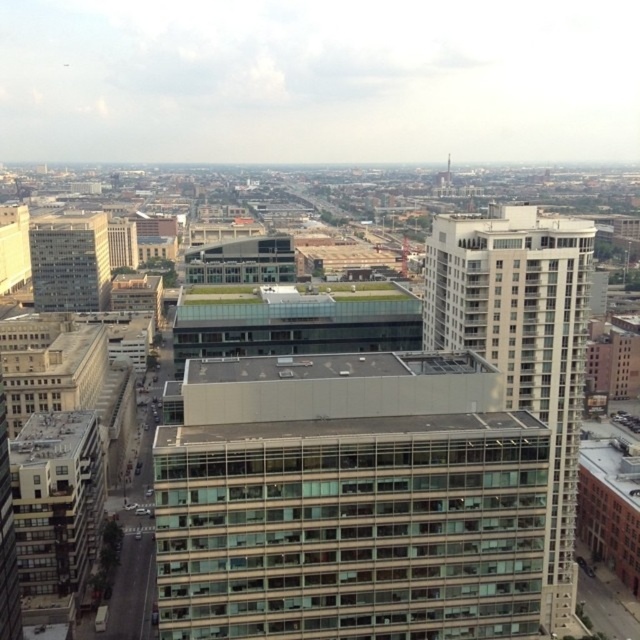
Question: Which object is closer to the camera taking this photo?

Choices:
 (A) white glass building at center
 (B) light gray concrete building at left

Answer: (A)

Question: Can you confirm if white glass building at center is thinner than light gray concrete building at left?

Choices:
 (A) no
 (B) yes

Answer: (B)

Question: Does white glass building at center have a larger size compared to light gray concrete building at left?

Choices:
 (A) no
 (B) yes

Answer: (A)

Question: Which of the following is the closest to the observer?

Choices:
 (A) light gray concrete building at left
 (B) white glass building at center

Answer: (B)

Question: Can you confirm if white glass building at center is smaller than light gray concrete building at left?

Choices:
 (A) yes
 (B) no

Answer: (A)